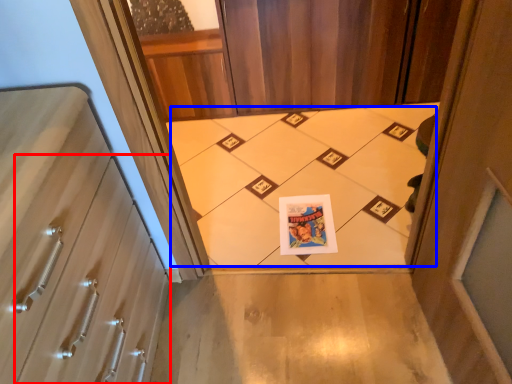
Question: Which object appears closest to the camera in this image, drawer (highlighted by a red box) or print (highlighted by a blue box)?

Choices:
 (A) drawer
 (B) print

Answer: (A)